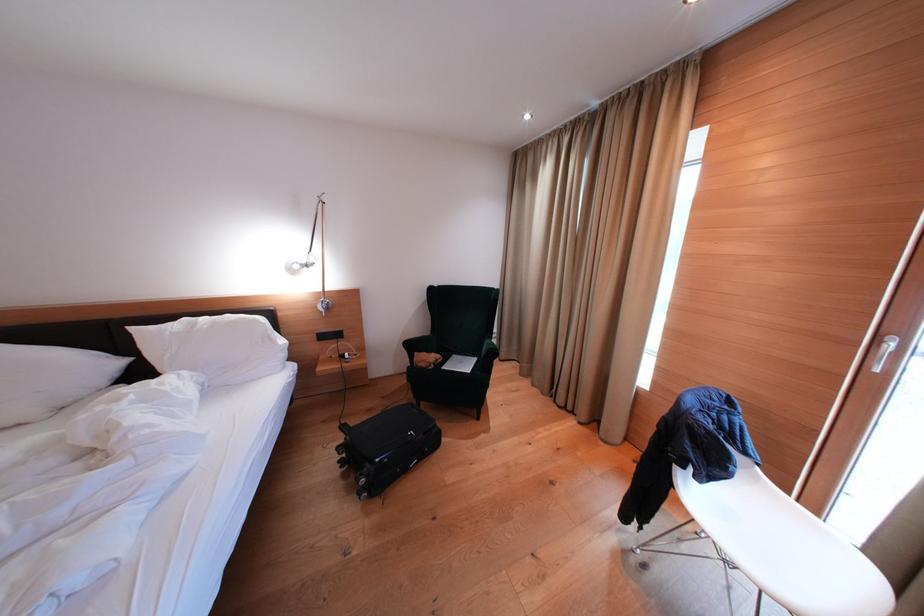
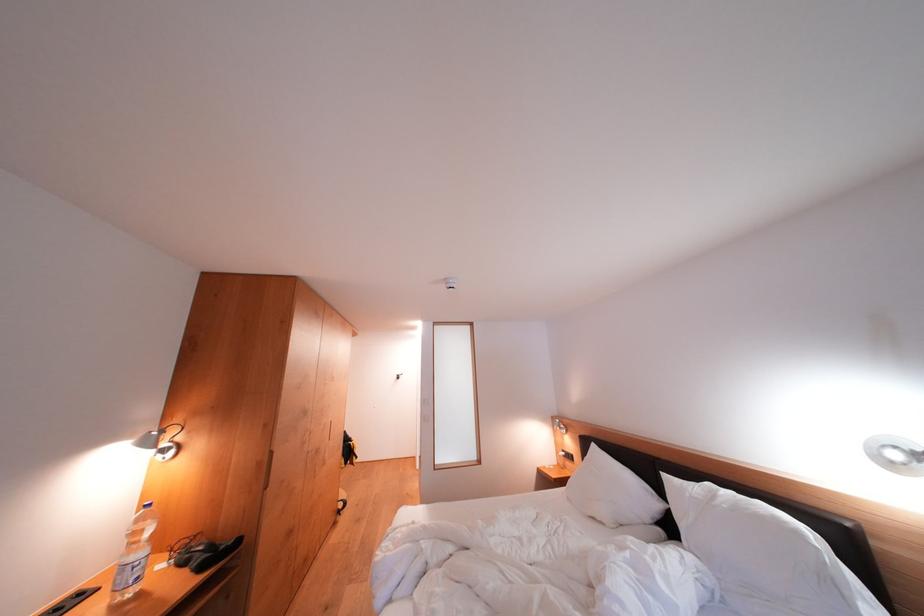
Question: How did the camera likely rotate?

Choices:
 (A) Left
 (B) Right
 (C) Up
 (D) Down

Answer: (A)